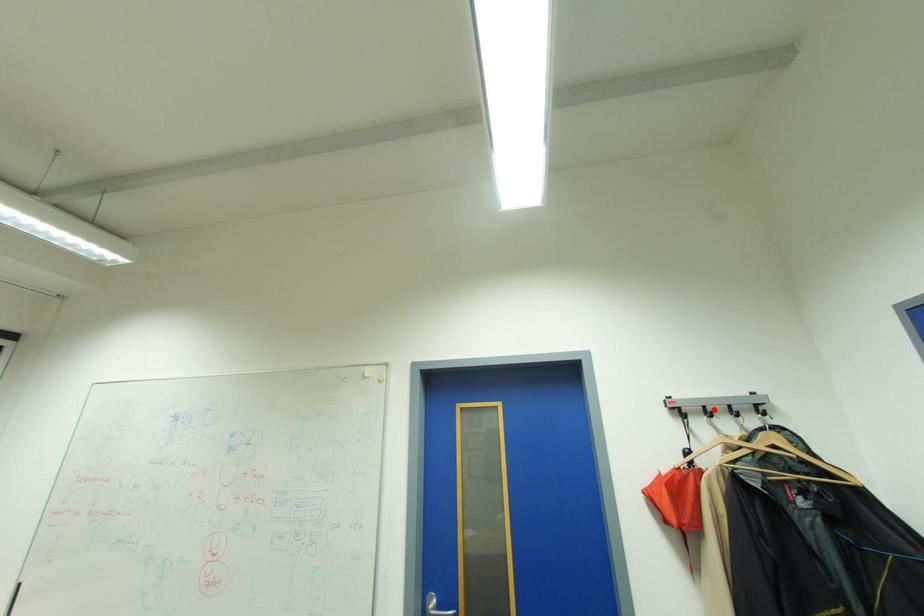
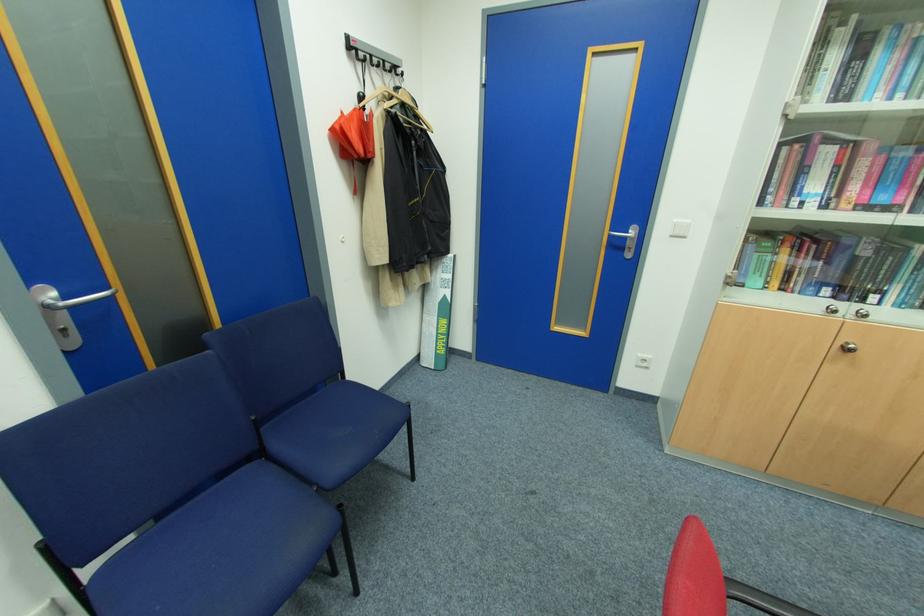
Find the pixel in the second image that matches the highlighted location in the first image.

(380, 60)